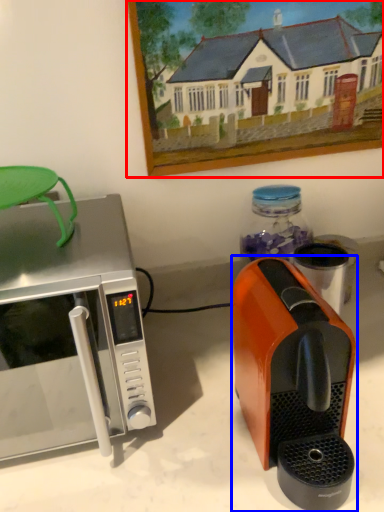
Question: Which point is further to the camera, picture frame (highlighted by a red box) or coffee maker (highlighted by a blue box)?

Choices:
 (A) picture frame
 (B) coffee maker

Answer: (A)